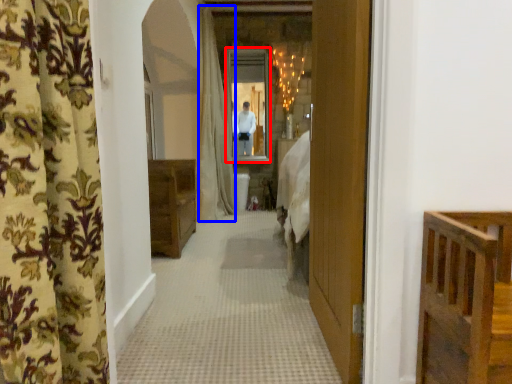
Question: Which of the following is the farthest to the observer, mirror (highlighted by a red box) or shower curtain (highlighted by a blue box)?

Choices:
 (A) mirror
 (B) shower curtain

Answer: (A)